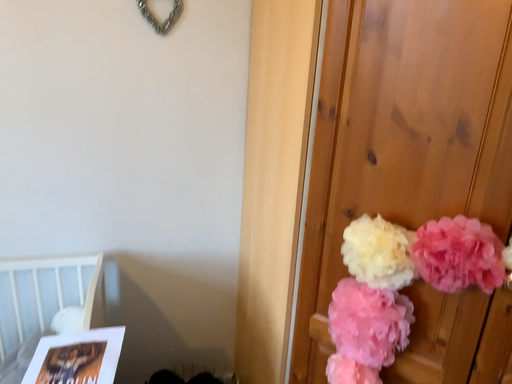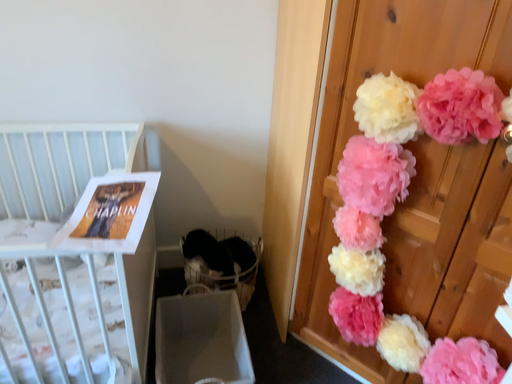
Question: How did the camera likely rotate when shooting the video?

Choices:
 (A) rotated left
 (B) rotated right

Answer: (A)